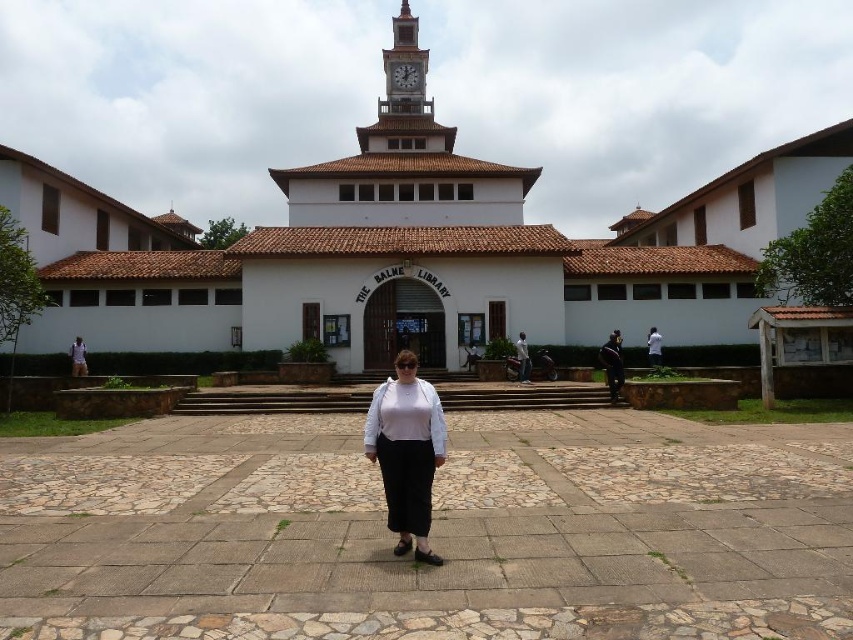
You are a photographer trying to capture a group photo of the two people wearing white shirts. The matte white shirt at lower left and the white shirt at center are the subjects. Which person should you focus on first if you want to ensure both are in frame?

You should focus on the matte white shirt at lower left first because it is larger and closer to the camera, ensuring both subjects remain in frame.

You are standing in front of the library and want to place a small potted plant. The potted plant must be placed exactly at the point with coordinates point (612, 364). What is the color of the surface where the potted plant will be placed?

The point (612, 364) is on black fabric at center, so the surface color is black.